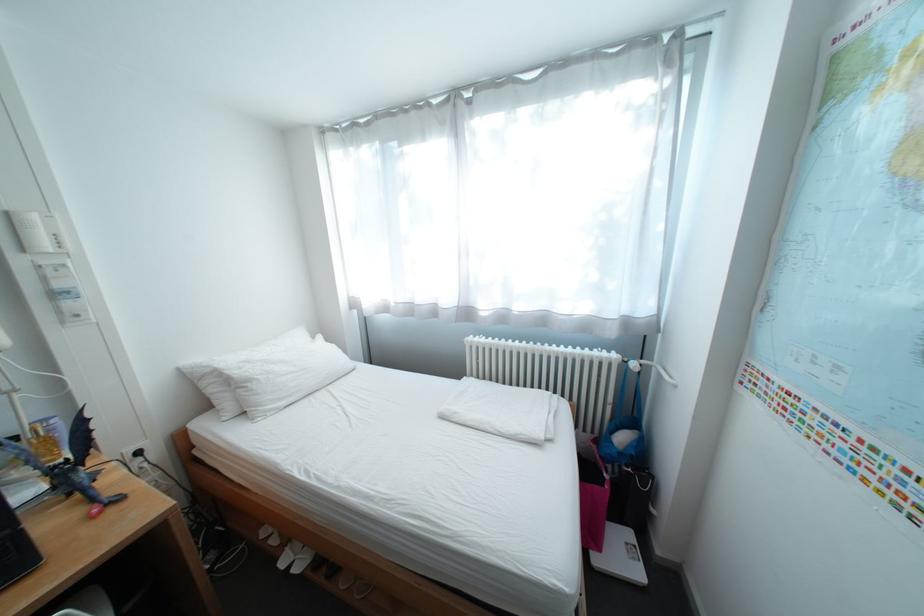
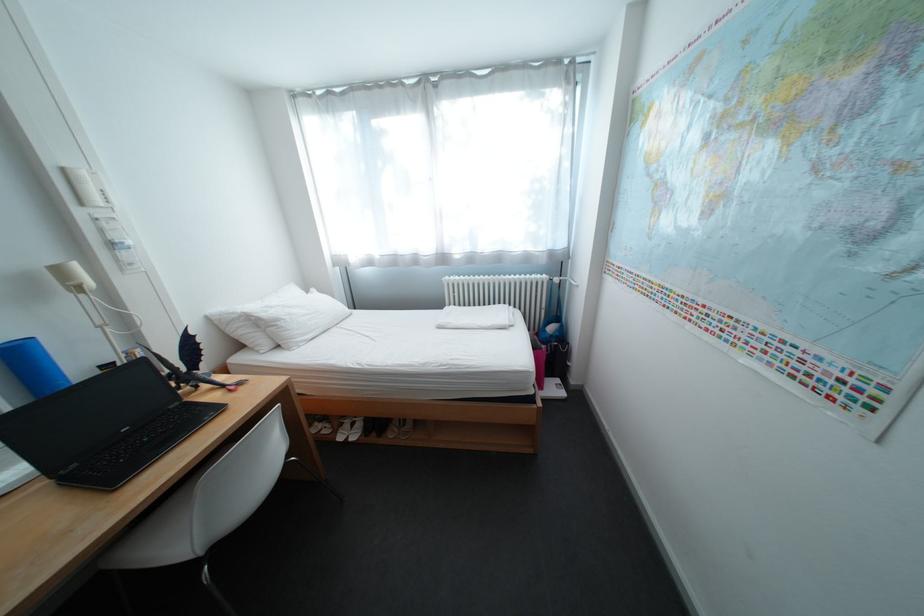
Where in the second image is the point corresponding to the point at 484,338 from the first image?

(459, 278)